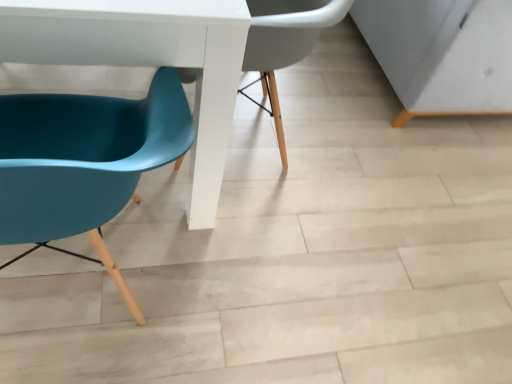
Locate an element on the screen. Image resolution: width=512 pixels, height=384 pixels. vacant space in front of teal plastic chair at left, the 1th chair viewed from the top is located at coordinates (259, 263).